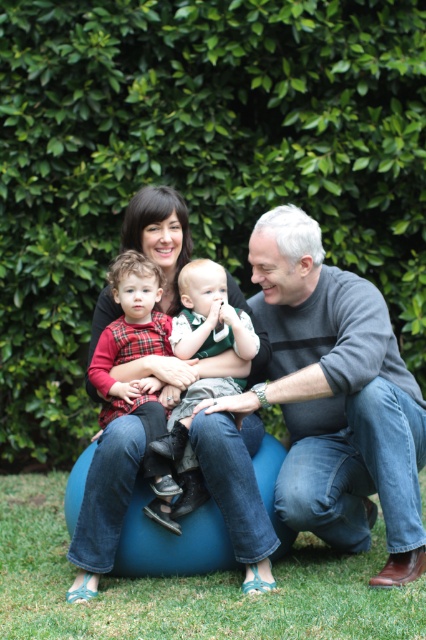
Question: Among these points, which one is nearest to the camera?

Choices:
 (A) (166, 445)
 (B) (244, 480)

Answer: (B)

Question: Can you confirm if flannel shirt at center is wider than plaid fabric shirt at center?

Choices:
 (A) no
 (B) yes

Answer: (A)

Question: Which point appears farthest from the camera in this image?

Choices:
 (A) (167, 493)
 (B) (186, 595)
 (C) (298, 420)

Answer: (C)

Question: Can you confirm if green leafy hedge at upper center is positioned to the left of flannel shirt at center?

Choices:
 (A) yes
 (B) no

Answer: (B)

Question: Can you confirm if green leafy hedge at upper center is positioned to the right of gray sweater at center?

Choices:
 (A) no
 (B) yes

Answer: (A)

Question: Which of the following is the closest to the observer?

Choices:
 (A) (98, 589)
 (B) (114, 497)

Answer: (B)